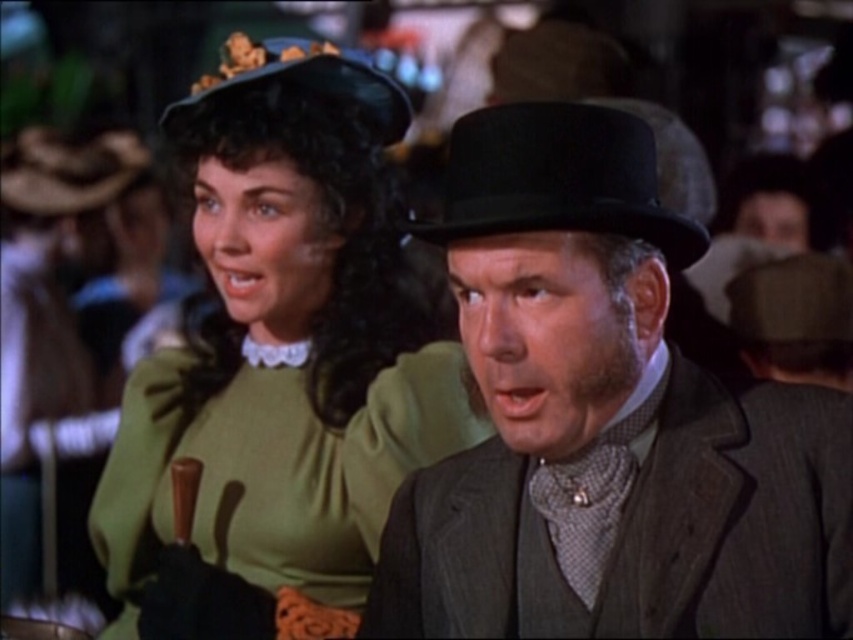
Question: Which point is closer to the camera taking this photo?

Choices:
 (A) (544, 129)
 (B) (354, 64)
 (C) (447, 236)
 (D) (332, 44)

Answer: (A)

Question: Which object is positioned farthest from the green velvet dress at upper left?

Choices:
 (A) matte black hat at center
 (B) black felt fedora at center

Answer: (B)

Question: Where is matte black hat at center located in relation to green velvet dress at upper left in the image?

Choices:
 (A) right
 (B) left

Answer: (A)

Question: Estimate the real-world distances between objects in this image. Which object is farther from the matte black hat at center?

Choices:
 (A) velvet black hat at upper left
 (B) green velvet dress at upper left
 (C) black felt fedora at center

Answer: (A)

Question: Does black felt fedora at center have a smaller size compared to velvet black hat at upper left?

Choices:
 (A) yes
 (B) no

Answer: (A)

Question: Can you confirm if matte black hat at center is positioned to the left of velvet black hat at upper left?

Choices:
 (A) no
 (B) yes

Answer: (A)